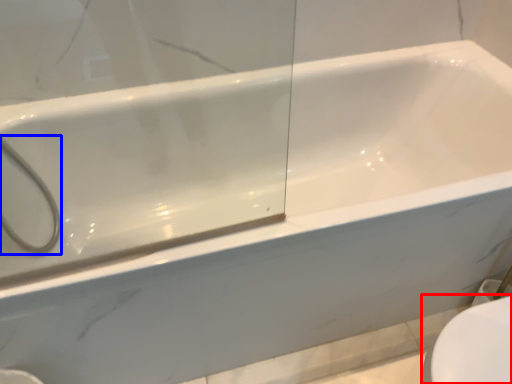
Question: Among these objects, which one is farthest to the camera, toilet bowl (highlighted by a red box) or shower (highlighted by a blue box)?

Choices:
 (A) toilet bowl
 (B) shower

Answer: (B)